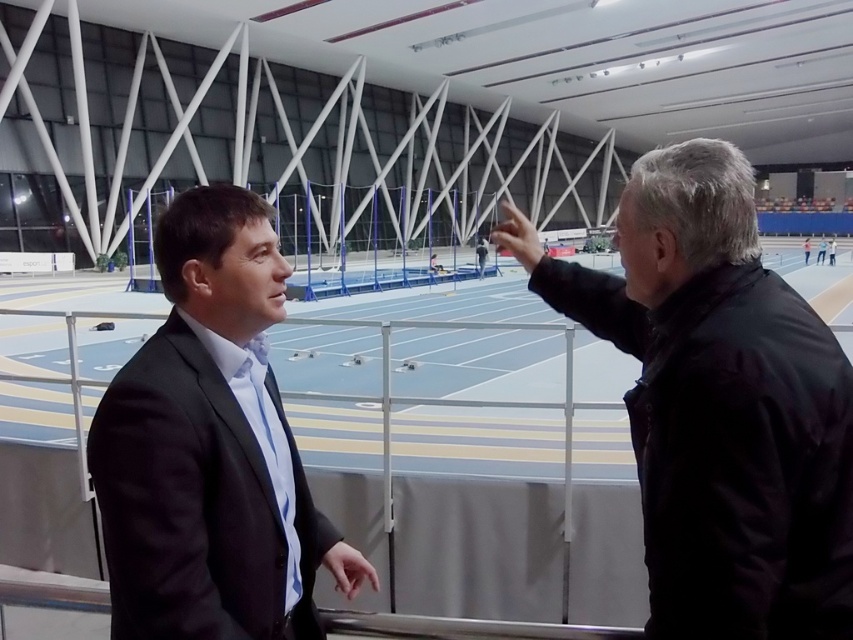
You are standing at the point with coordinates point (254, 440) and want to walk to the exit located at point (759, 435). Which direction should you move to reach the exit?

You should move forward because point (759, 435) is in front of point (254, 440).

You are standing at the entrance of the sports facility and want to take a photo. There are two points marked in the scene, point (212,212) and point (279,468). Which point should you focus on to ensure it appears larger in your photo?

Point (212,212) is closer to the camera than point (279,468), so focusing on point (212,212) will make it appear larger in the photo.

You are a photographer setting up a camera at the back of the sports facility. You need to ensure both the matte black suit at center and the blue silk tie at left are fully visible in the frame. Based on their positions, which object is more likely to block the view of the other?

The matte black suit at center might block the view of the blue silk tie at left since it is wider and positioned centrally, potentially obscuring the tie on the left side.